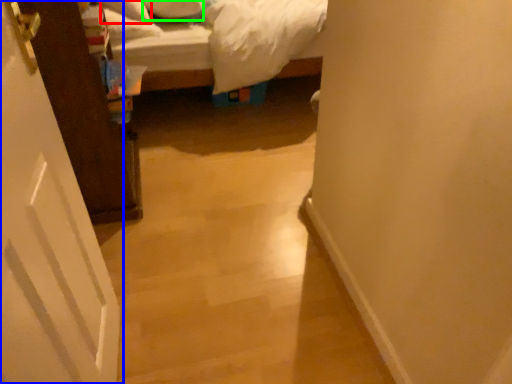
Question: Which object is positioned farthest from pillow (highlighted by a red box)? Select from door (highlighted by a blue box) and pillow (highlighted by a green box).

Choices:
 (A) door
 (B) pillow

Answer: (A)